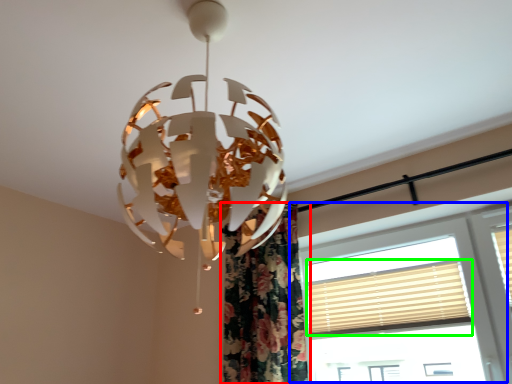
Question: Estimate the real-world distances between objects in this image. Which object is closer to curtain (highlighted by a red box), window (highlighted by a blue box) or blind (highlighted by a green box)?

Choices:
 (A) window
 (B) blind

Answer: (B)